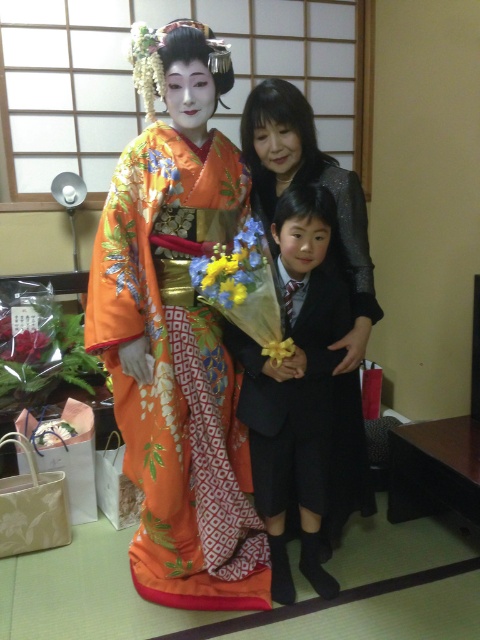
You are a photographer taking a photo of the black smooth suit at center and the yellow matte flower at center. Which object should you focus on first if you want to ensure both are in focus, considering their heights?

The black smooth suit at center is taller than the yellow matte flower at center, so focusing on the black smooth suit at center first will help ensure both are in focus as it is the taller object.

You are a photographer arranging a photo shoot in a traditional Japanese setting. You have two main elements to position correctly for the shot. The black smooth suit at center and the yellow matte flower at center. According to the scene description, which object is located to the right of the other?

The black smooth suit at center is positioned on the right side of yellow matte flower at center.

You are standing in front of the camera capturing the photo of the three individuals. You want to check if the point at coordinate point (333, 417) is within the camera frame. Can you confirm if this point is inside the frame?

The point at coordinate point (333, 417) is 6.35 feet away from the camera, so it is within the camera frame.